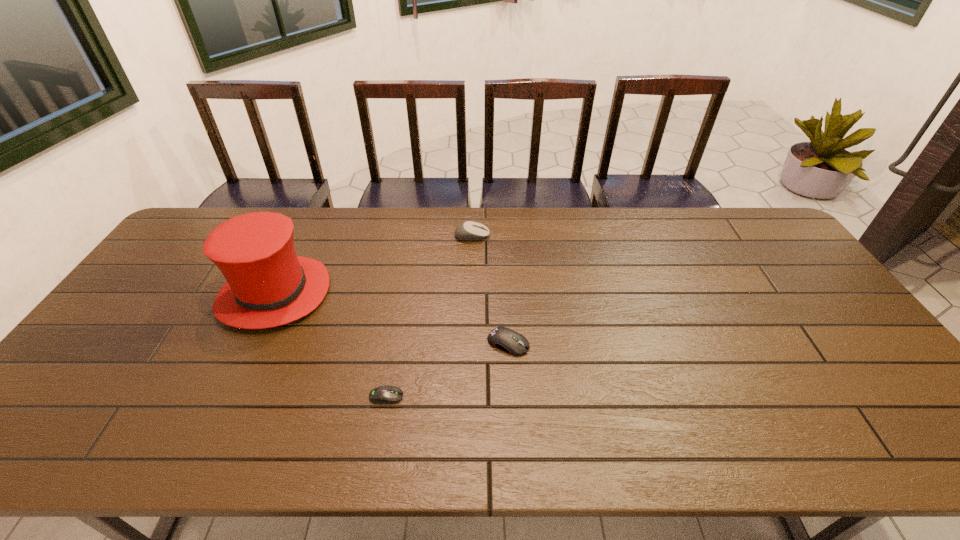
You are a GUI agent. You are given a task and a screenshot of the screen. Output one action in this format:
    pyautogui.click(x=<x>, y=<y>)
    Task: Click on the free space located on the right of the second farthest computer mouse
    This screenshot has height=540, width=960.
    Given the screenshot: What is the action you would take?
    pyautogui.click(x=680, y=343)

This screenshot has height=540, width=960. In order to click on free space located on the wheel side of the nearest object in this screenshot , I will do `click(437, 396)`.

This screenshot has width=960, height=540. I want to click on object that is at the far edge, so click(467, 231).

Where is `free space at the far edge`? free space at the far edge is located at coordinates (412, 212).

In the image, there is a desktop. Where is `vacant space at the near edge`? This screenshot has height=540, width=960. vacant space at the near edge is located at coordinates (414, 423).

Identify the location of vacant point at the left edge. The image size is (960, 540). (157, 275).

Find the location of `vacant space at the right edge of the desktop`. vacant space at the right edge of the desktop is located at coordinates (839, 345).

The height and width of the screenshot is (540, 960). In the image, there is a desktop. What are the coordinates of `vacant space at the far right corner` in the screenshot? It's located at (743, 238).

You are a GUI agent. You are given a task and a screenshot of the screen. Output one action in this format:
    pyautogui.click(x=<x>, y=<y>)
    Task: Click on the free space between the nearest computer mouse and the farthest computer mouse
    The height and width of the screenshot is (540, 960).
    Given the screenshot: What is the action you would take?
    pyautogui.click(x=429, y=316)

I want to click on free space between the nearest object and the third shortest object, so click(429, 316).